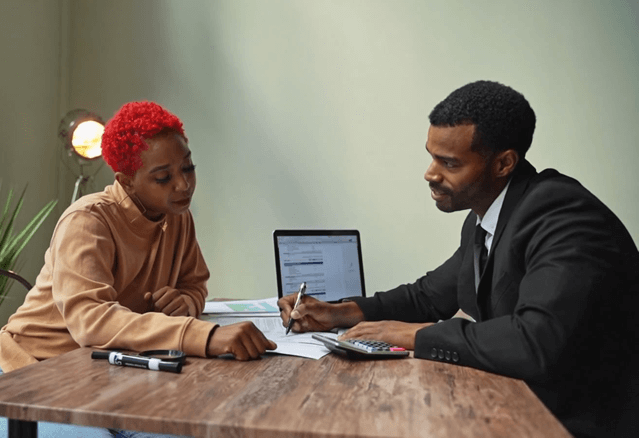
Where is `brown table`? Image resolution: width=639 pixels, height=438 pixels. brown table is located at coordinates (472, 417).